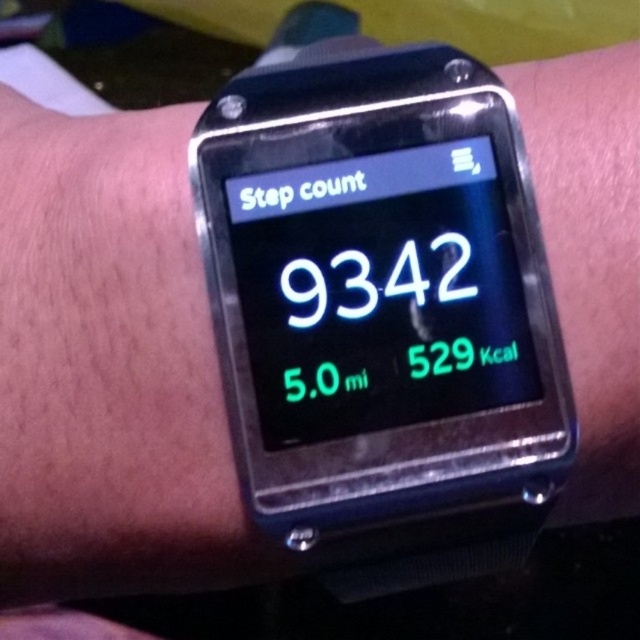
Is the position of black plastic watch at center less distant than that of black matte watch at center?

Yes, black plastic watch at center is in front of black matte watch at center.

Can you confirm if black plastic watch at center is taller than black matte watch at center?

No.

Does point (400, 148) lie behind point (12, 276)?

That is False.

Find the location of a particular element. black plastic watch at center is located at coordinates (381, 307).